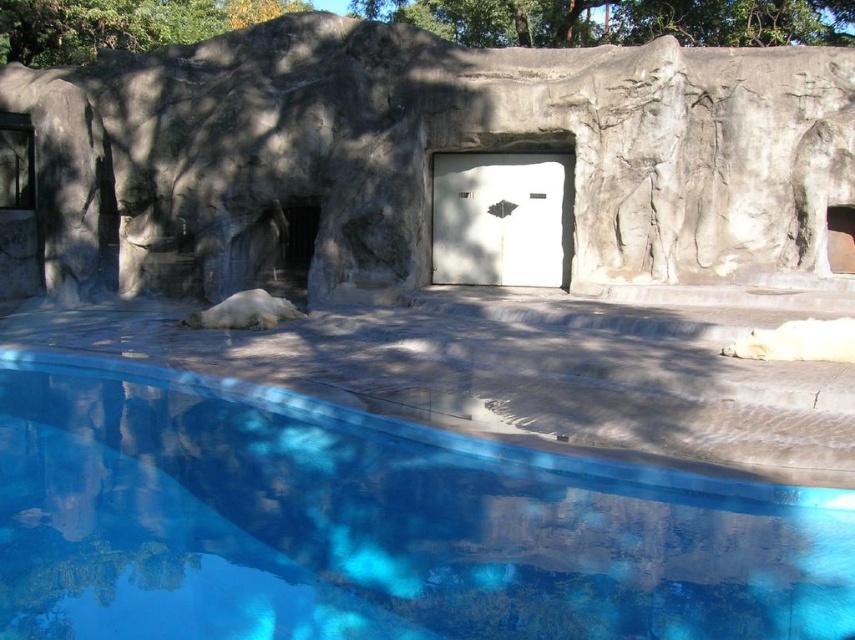
Is the position of blue smooth water at lower center more distant than that of gray stone wall at center?

No, it is not.

Who is more distant from viewer, (x=204, y=500) or (x=169, y=282)?

The point (x=169, y=282) is behind.

Locate an element on the screen. The image size is (855, 640). blue smooth water at lower center is located at coordinates (373, 525).

Can you confirm if gray stone wall at center is positioned to the right of green leafy tree at upper center?

In fact, gray stone wall at center is to the left of green leafy tree at upper center.

Is gray stone wall at center below green leafy tree at upper center?

Correct, gray stone wall at center is located below green leafy tree at upper center.

Between point (612, 81) and point (48, 29), which one is positioned behind?

Point (48, 29)

Image resolution: width=855 pixels, height=640 pixels. Find the location of `gray stone wall at center`. gray stone wall at center is located at coordinates (428, 156).

Who is more distant from viewer, (223, 445) or (503, 13)?

Point (503, 13)

Can you confirm if blue smooth water at lower center is wider than green leafy tree at upper center?

In fact, blue smooth water at lower center might be narrower than green leafy tree at upper center.

Which is behind, point (787, 528) or point (186, 40)?

Point (186, 40)

Where is `blue smooth water at lower center`? The width and height of the screenshot is (855, 640). blue smooth water at lower center is located at coordinates (373, 525).